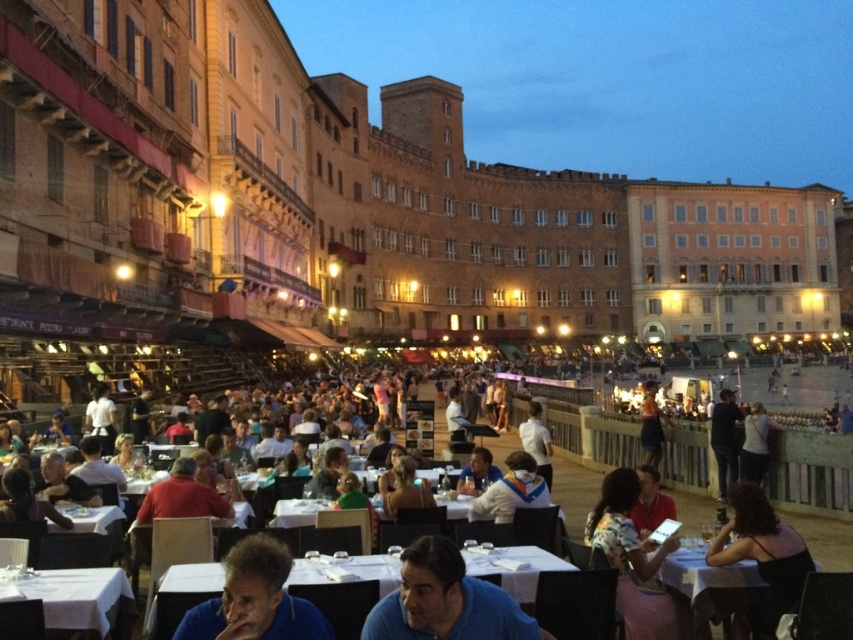
Question: Which point is farther from the camera taking this photo?

Choices:
 (A) (799, 582)
 (B) (119, 570)

Answer: (A)

Question: Does blue cotton shirt at lower center appear on the right side of white fabric shirt at center?

Choices:
 (A) no
 (B) yes

Answer: (A)

Question: Is floral-patterned blouse at center to the left of matte white shirt at center from the viewer's perspective?

Choices:
 (A) no
 (B) yes

Answer: (A)

Question: Does blue fabric shirt at lower center appear on the right side of matte white shirt at center?

Choices:
 (A) no
 (B) yes

Answer: (A)

Question: Among these objects, which one is nearest to the camera?

Choices:
 (A) matte white shirt at center
 (B) dark blue shirt at center
 (C) blue fabric shirt at lower center
 (D) white fabric shirt at center

Answer: (C)

Question: Which object appears farthest from the camera in this image?

Choices:
 (A) blue cotton shirt at lower center
 (B) white fabric table at lower center
 (C) dark blue shirt at center
 (D) white fabric shirt at center

Answer: (C)